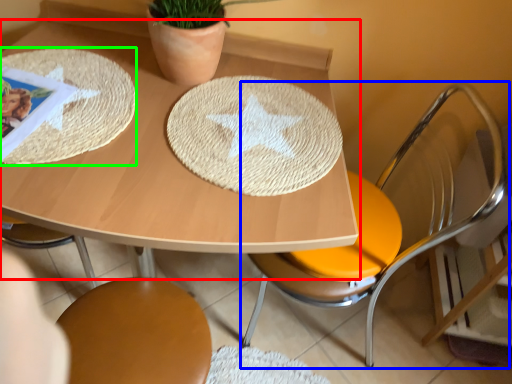
Question: Which is farther away from table (highlighted by a red box)? chair (highlighted by a blue box) or mat (highlighted by a green box)?

Choices:
 (A) chair
 (B) mat

Answer: (A)